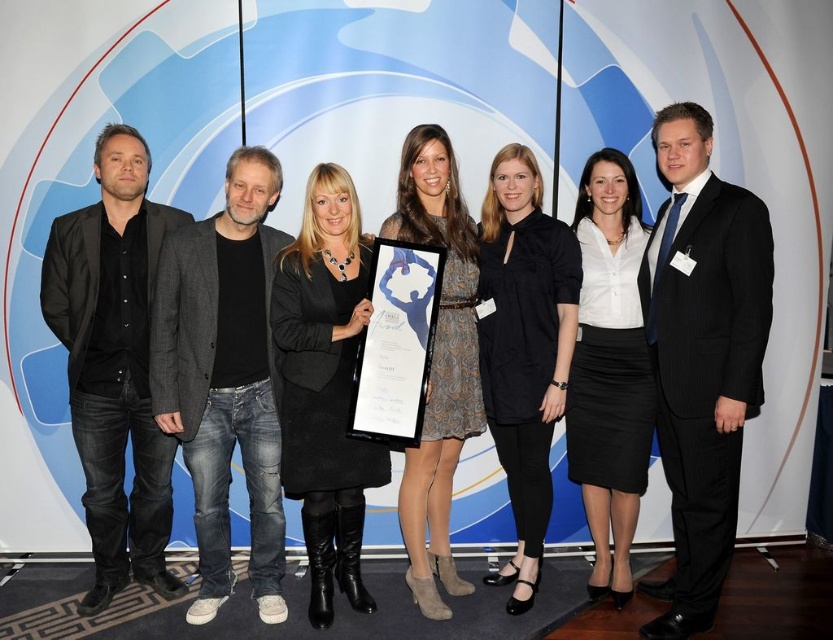
The image size is (833, 640). I want to click on black pinstripe suit at center, so click(701, 356).

This screenshot has height=640, width=833. Find the location of `black pinstripe suit at center`. black pinstripe suit at center is located at coordinates (701, 356).